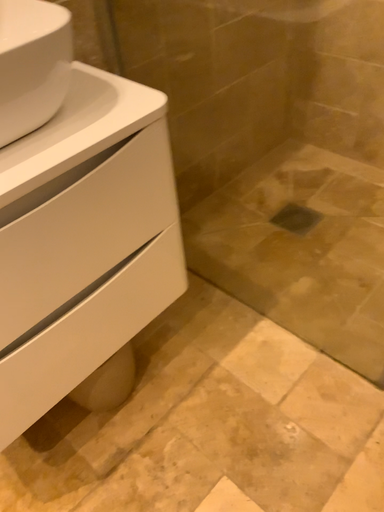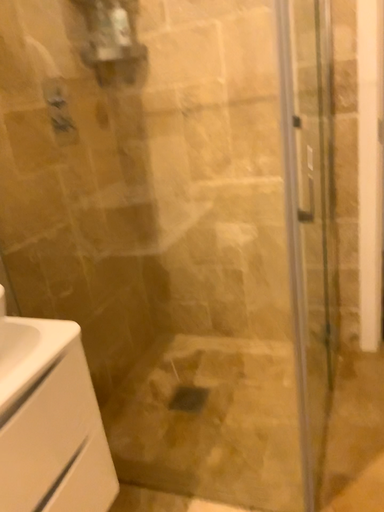
Question: Which way did the camera rotate in the video?

Choices:
 (A) rotated left
 (B) rotated right

Answer: (B)